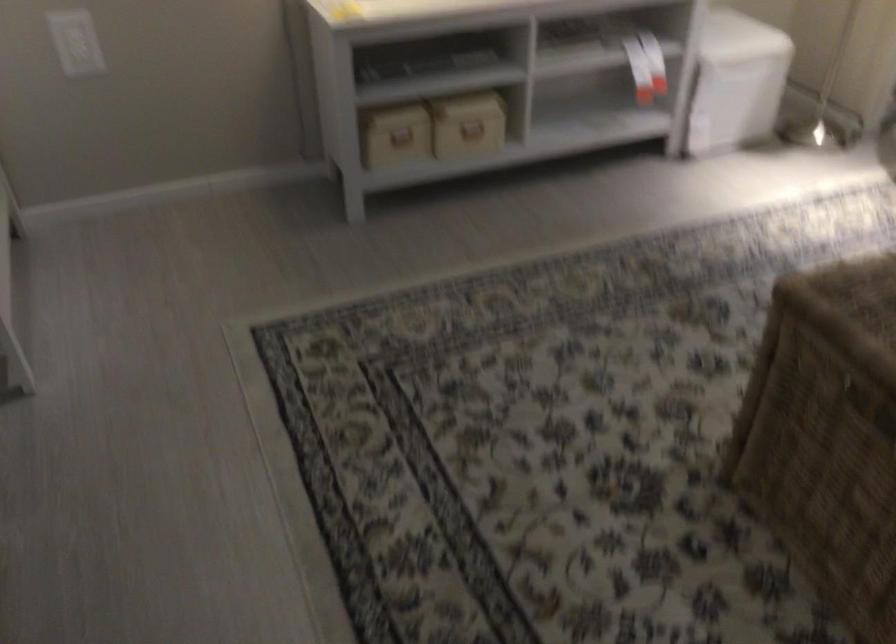
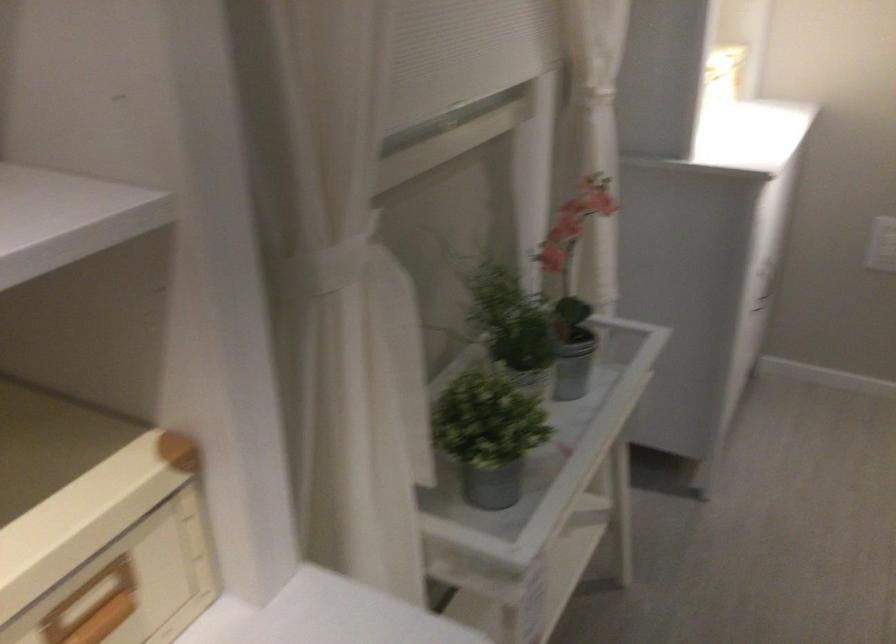
Question: The camera is either moving clockwise (left) or counter-clockwise (right) around the object. The first image is from the beginning of the video and the second image is from the end. Is the camera moving left or right when shooting the video?

Choices:
 (A) Left
 (B) Right

Answer: (B)